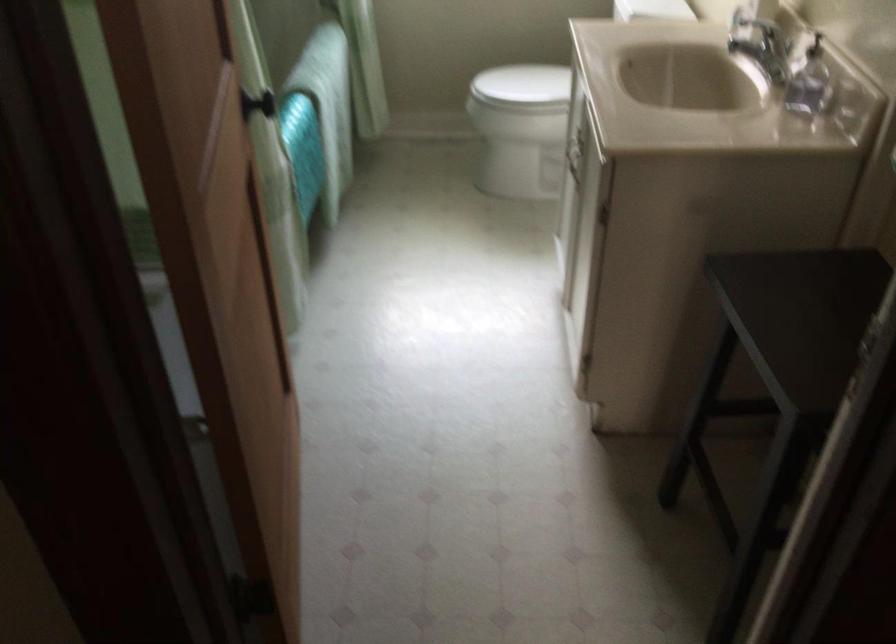
At what (x,y) coordinates should I click in order to perform the action: click on soap dispenser pump. Please return your answer as a coordinate pair (x, y). This screenshot has width=896, height=644. Looking at the image, I should click on (814, 46).